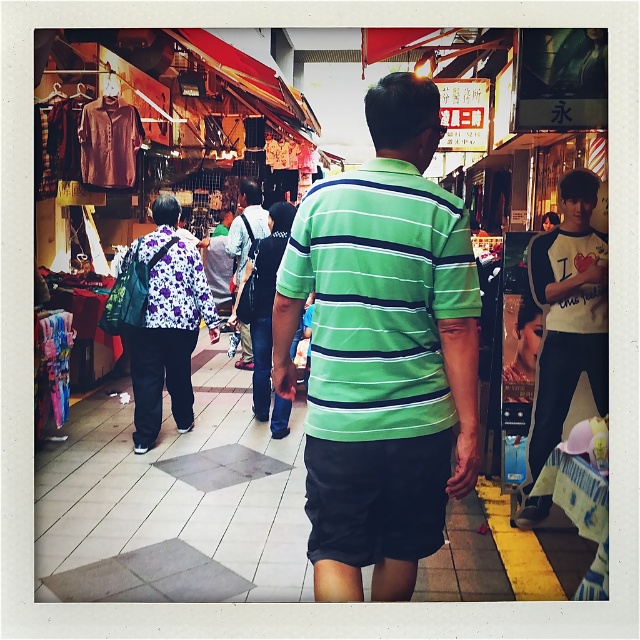
Who is more distant from viewer, (566, 312) or (152, 237)?

Positioned behind is point (152, 237).

Does white cotton t-shirt at right appear on the left side of floral fabric shirt at center?

In fact, white cotton t-shirt at right is to the right of floral fabric shirt at center.

Does point (570, 196) come in front of point (166, 364)?

Yes, it is.

I want to click on white cotton t-shirt at right, so click(568, 314).

Which is below, green striped polo shirt at center or white cotton t-shirt at right?

Positioned lower is white cotton t-shirt at right.

You are a GUI agent. You are given a task and a screenshot of the screen. Output one action in this format:
    pyautogui.click(x=<x>, y=<y>)
    Task: Click on the green striped polo shirt at center
    Image resolution: width=640 pixels, height=640 pixels.
    Given the screenshot: What is the action you would take?
    pyautogui.click(x=381, y=352)

The height and width of the screenshot is (640, 640). I want to click on white cotton t-shirt at right, so (x=568, y=314).

Is white cotton t-shirt at right to the right of denim shorts at center from the viewer's perspective?

Correct, you'll find white cotton t-shirt at right to the right of denim shorts at center.

The width and height of the screenshot is (640, 640). What are the coordinates of `white cotton t-shirt at right` in the screenshot? It's located at (568, 314).